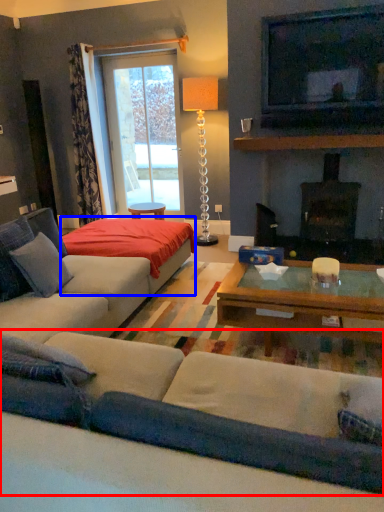
Question: Which object is closer to the camera taking this photo, studio couch (highlighted by a red box) or plain (highlighted by a blue box)?

Choices:
 (A) studio couch
 (B) plain

Answer: (A)